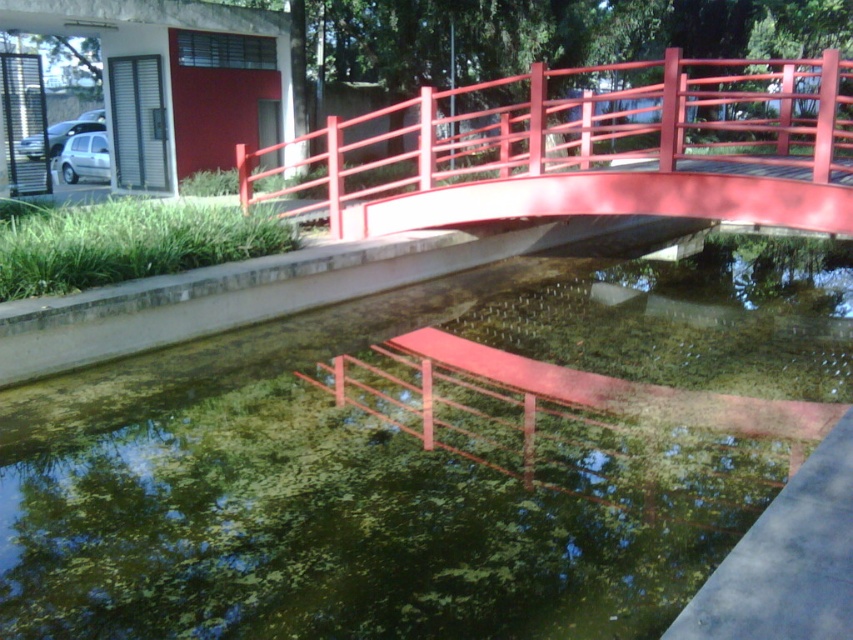
Based on the photo, you are standing at the edge of the water and want to cross to the other side. The glossy metal bridge at upper center and the green leafy algae at lower left are in your view. Which object is closer to you?

The glossy metal bridge at upper center is closer to you since it is positioned in front of the green leafy algae at lower left.